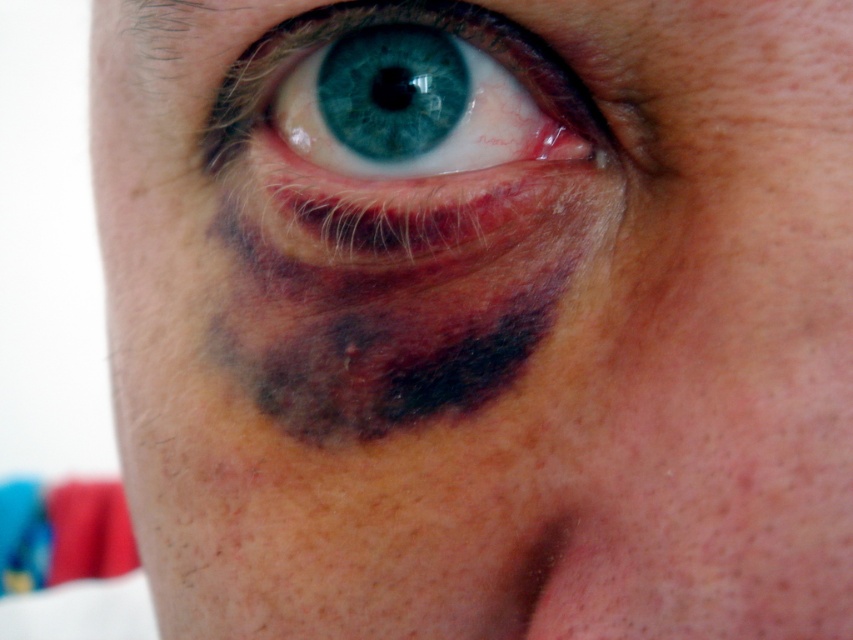
You are a dermatologist examining a closeup of a patient. The patient has a concern about a spot on their face. You see the matte skin at upper center. Where exactly is this area located in relation to the eye?

The matte skin at upper center is located at point (482, 307), which is above the eye and slightly to the right of the center of the face.

You are a photographer checking the focus of your closeup portrait. You want to ensure that both the matte skin at upper center and the brown hair at upper left are in focus. Given that your camera can only focus on one object at a time, which object should you prioritize focusing on to ensure the larger one is sharp?

The matte skin at upper center is larger in size than the brown hair at upper left, so you should prioritize focusing on the matte skin at upper center to ensure the larger object is sharp.